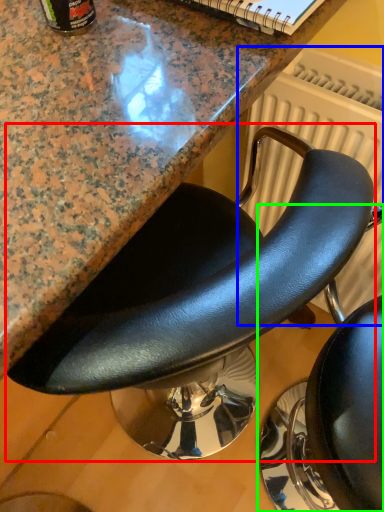
Question: Which object is the closest to the chair (highlighted by a red box)? Choose among these: radiator (highlighted by a blue box) or chair (highlighted by a green box).

Choices:
 (A) radiator
 (B) chair

Answer: (A)